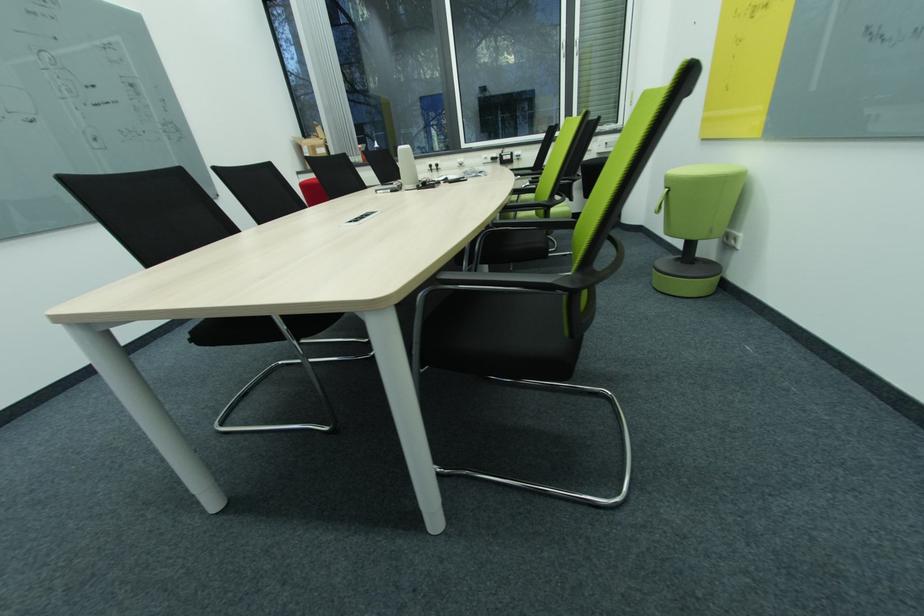
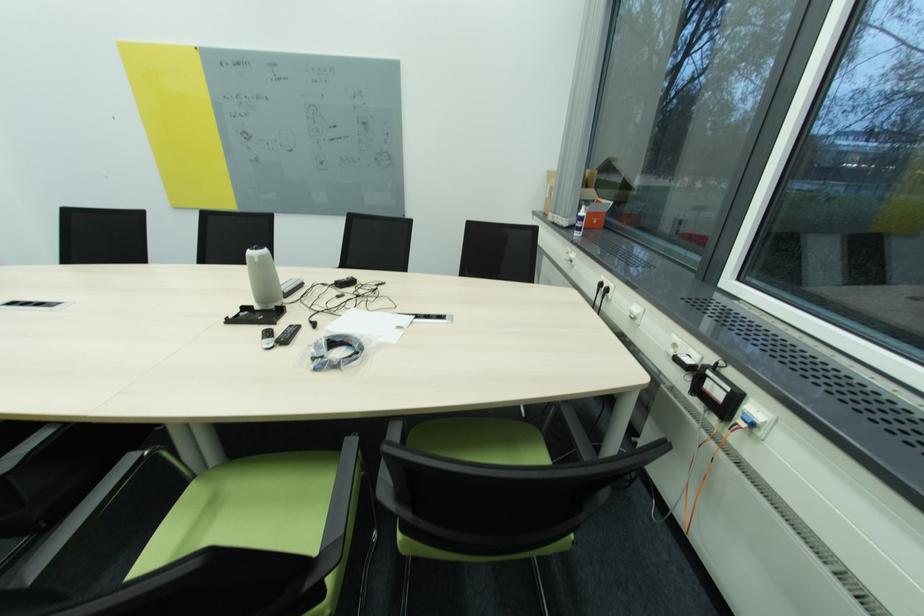
Find the pixel in the second image that matches (442,167) in the first image.

(612, 291)